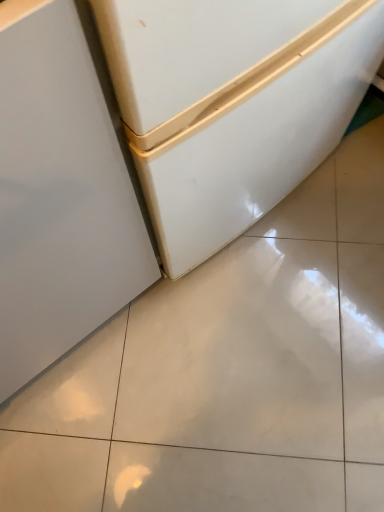
Locate an element on the screen. This screenshot has height=512, width=384. white glossy refrigerator at center is located at coordinates (62, 190).

The width and height of the screenshot is (384, 512). What do you see at coordinates (62, 190) in the screenshot?
I see `white glossy refrigerator at center` at bounding box center [62, 190].

Find the location of a particular element. Image resolution: width=384 pixels, height=512 pixels. white glossy refrigerator at center is located at coordinates (62, 190).